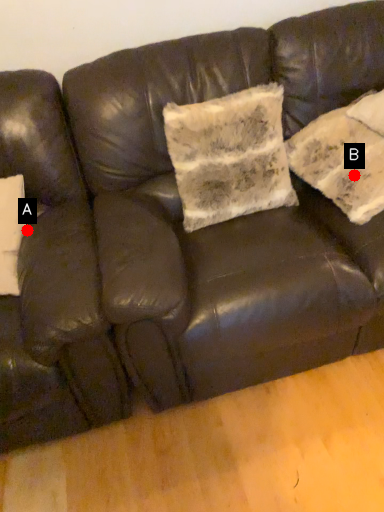
Question: Two points are circled on the image, labeled by A and B beside each circle. Which point appears closest to the camera in this image?

Choices:
 (A) A is closer
 (B) B is closer

Answer: (A)